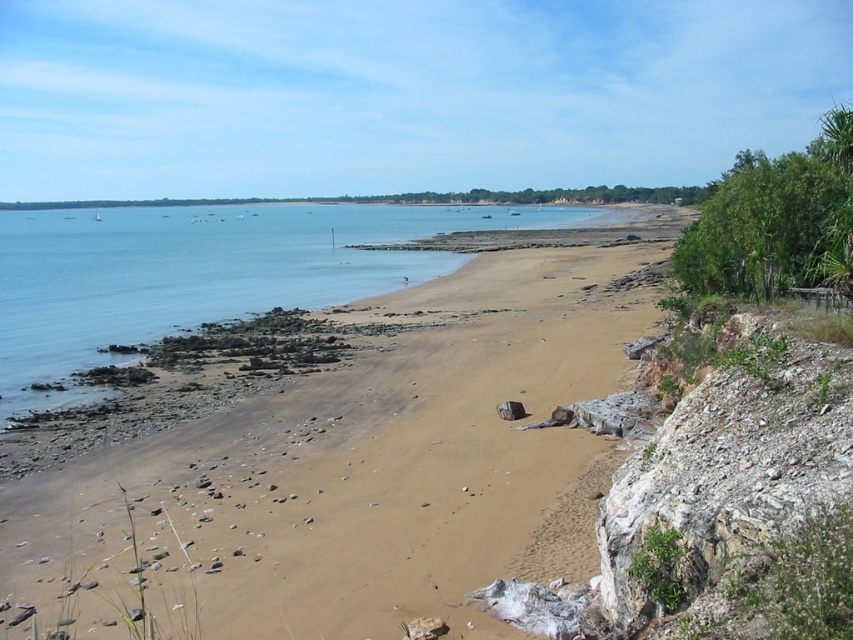
Question: Among these points, which one is nearest to the camera?

Choices:
 (A) (498, 208)
 (B) (56, 532)

Answer: (B)

Question: Does brown sand at center appear over blue water at center?

Choices:
 (A) yes
 (B) no

Answer: (B)

Question: Which point appears closest to the camera in this image?

Choices:
 (A) (231, 595)
 (B) (318, 292)

Answer: (A)

Question: Is brown sand at center above blue water at center?

Choices:
 (A) no
 (B) yes

Answer: (A)

Question: Does brown sand at center appear on the right side of blue water at center?

Choices:
 (A) no
 (B) yes

Answer: (B)

Question: Which of the following is the farthest from the observer?

Choices:
 (A) brown sand at center
 (B) blue water at center

Answer: (B)